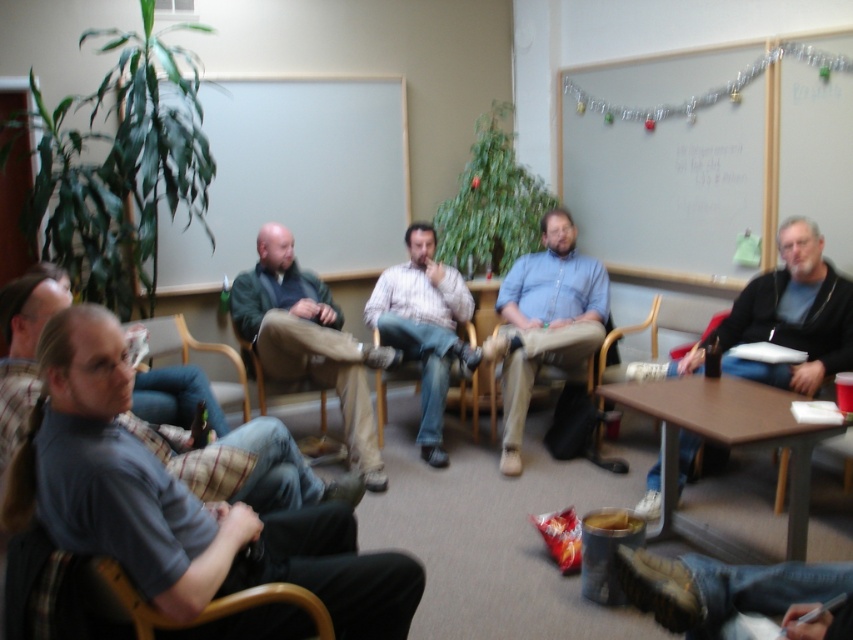
Question: Is green fabric jacket at center further to camera compared to matte gray shirt at center?

Choices:
 (A) no
 (B) yes

Answer: (B)

Question: Considering the real-world distances, which object is farthest from the matte gray shirt at center?

Choices:
 (A) whiteboard at upper center
 (B) wooden chair at lower left
 (C) striped cotton shirt at center

Answer: (B)

Question: Is the position of whiteboard at upper center more distant than that of denim at center?

Choices:
 (A) no
 (B) yes

Answer: (B)

Question: Which object is positioned farthest from the wooden chair at lower left?

Choices:
 (A) blue shirt at center
 (B) gray fabric shirt at left
 (C) matte gray shirt at center
 (D) brown wood table at lower center

Answer: (A)

Question: Which point is farther to the camera?

Choices:
 (A) [215, 176]
 (B) [105, 568]
 (C) [167, 400]
 (D) [758, 426]

Answer: (A)

Question: Does striped cotton shirt at center have a lesser width compared to matte gray armchair at center?

Choices:
 (A) yes
 (B) no

Answer: (B)